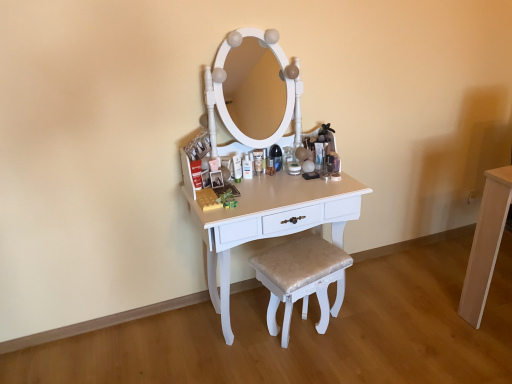
At what (x,y) coordinates should I click in order to perform the action: click on vacant area that lies between shiny beige cushioned stool at center and white glossy table at center, which appears as the 1th table when viewed from the left. Please return your answer as a coordinate pair (x, y). The image size is (512, 384). Looking at the image, I should click on (276, 357).